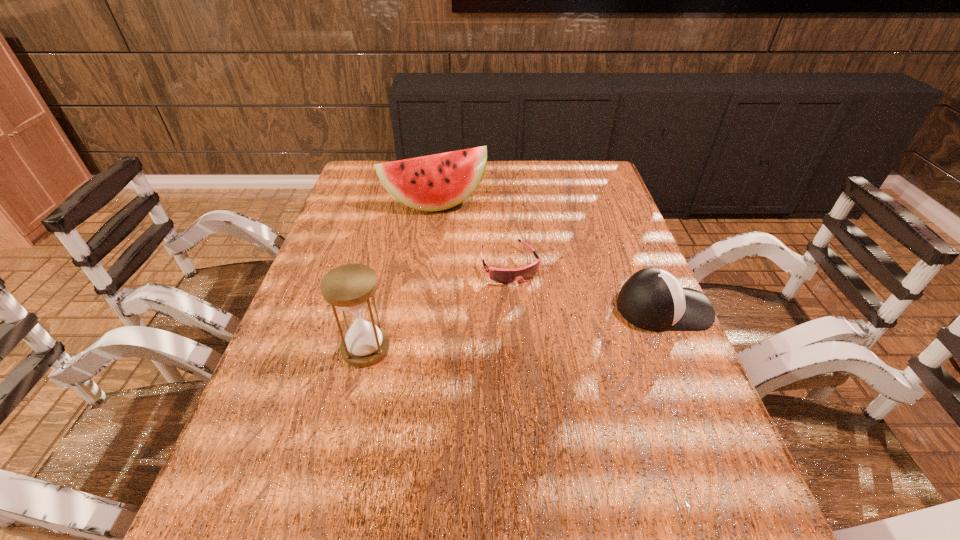
You are a GUI agent. You are given a task and a screenshot of the screen. Output one action in this format:
    pyautogui.click(x=<x>, y=<y>)
    Task: Click on the vacant area located 0.400m on the front-facing side of the shortest object
    Image resolution: width=960 pixels, height=540 pixels.
    Given the screenshot: What is the action you would take?
    pyautogui.click(x=588, y=421)

Find the location of a particular element. The image size is (960, 540). blank area located on the front-facing side of the shortest object is located at coordinates (551, 350).

The height and width of the screenshot is (540, 960). I want to click on free location located 0.380m on the front-facing side of the shortest object, so click(x=583, y=412).

I want to click on object that is positioned at the far edge, so 437,182.

This screenshot has width=960, height=540. I want to click on hourglass that is at the left edge, so click(x=349, y=287).

I want to click on watermelon at the left edge, so click(x=437, y=182).

Locate an element on the screen. This screenshot has width=960, height=540. object that is positioned at the right edge is located at coordinates (652, 299).

The width and height of the screenshot is (960, 540). I want to click on object that is at the far left corner, so click(x=437, y=182).

Identify the location of free space at the near edge. This screenshot has height=540, width=960. (484, 437).

Where is `vacant space at the left edge of the desktop`? This screenshot has width=960, height=540. vacant space at the left edge of the desktop is located at coordinates (322, 312).